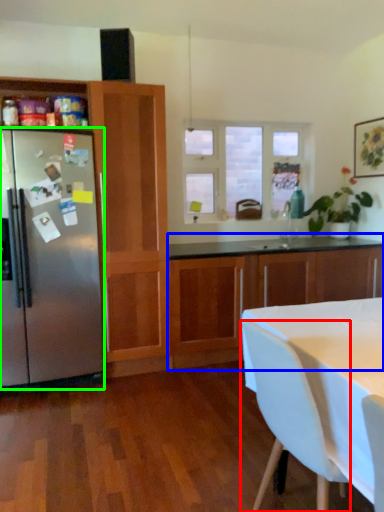
Question: Considering the real-world distances, which object is closest to chair (highlighted by a red box)? cabinetry (highlighted by a blue box) or refrigerator (highlighted by a green box).

Choices:
 (A) cabinetry
 (B) refrigerator

Answer: (B)